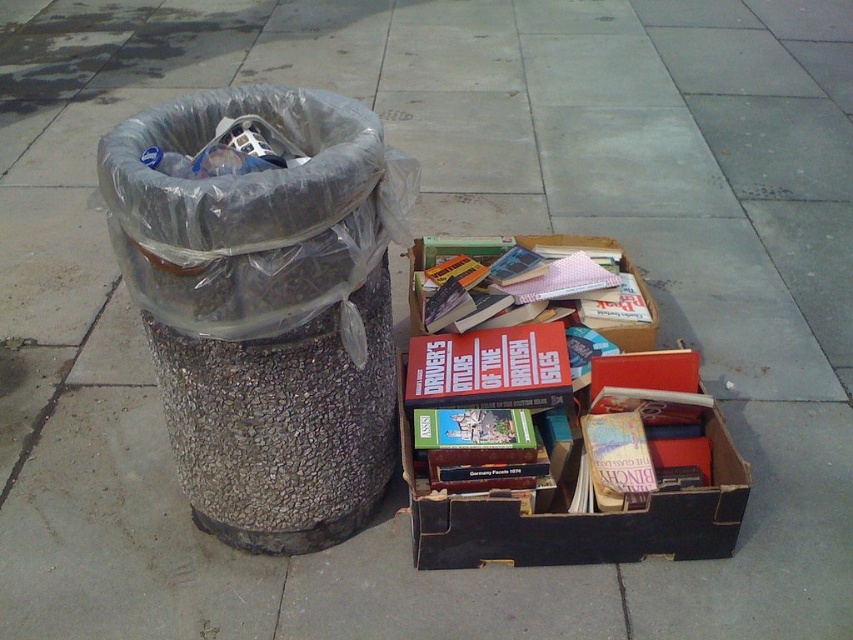
Is point (323, 413) more distant than point (426, 552)?

That is False.

Does clear plastic trash can at left have a greater height compared to cardboard box at center?

Indeed, clear plastic trash can at left has a greater height compared to cardboard box at center.

Between point (163, 257) and point (700, 504), which one is positioned behind?

Point (700, 504)

You are a GUI agent. You are given a task and a screenshot of the screen. Output one action in this format:
    pyautogui.click(x=<x>, y=<y>)
    Task: Click on the clear plastic trash can at left
    This screenshot has height=640, width=853.
    Given the screenshot: What is the action you would take?
    pyautogui.click(x=265, y=307)